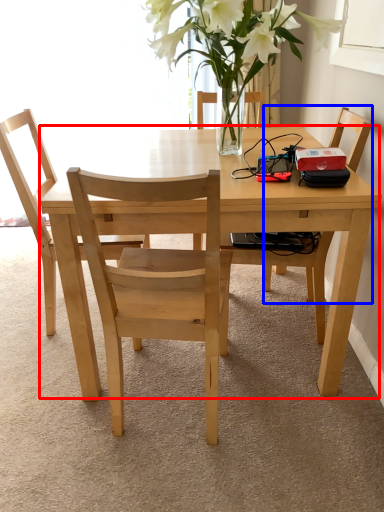
Question: Which object is further to the camera taking this photo, kitchen & dining room table (highlighted by a red box) or chair (highlighted by a blue box)?

Choices:
 (A) kitchen & dining room table
 (B) chair

Answer: (B)